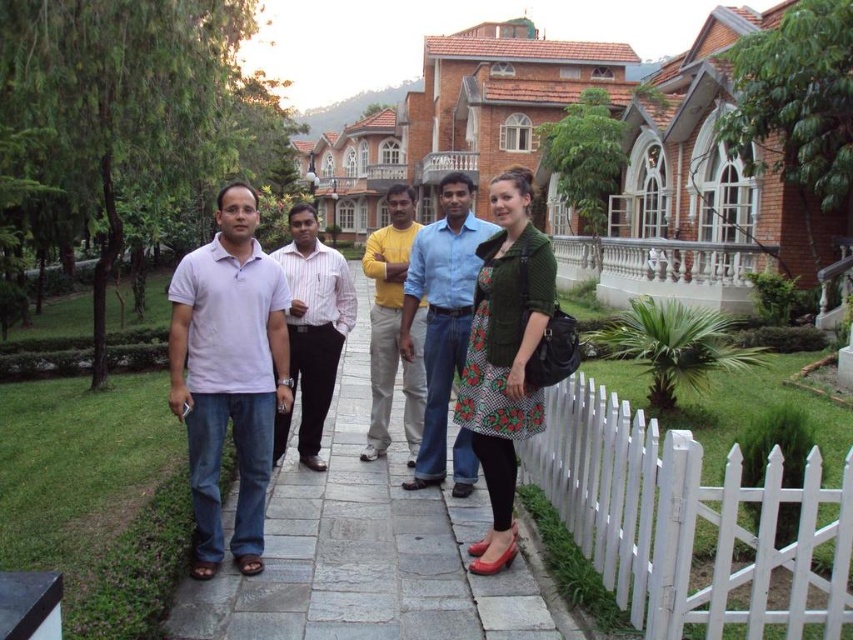
Is white wooden fence at lower right above striped cotton shirt at center?

Incorrect, white wooden fence at lower right is not positioned above striped cotton shirt at center.

Consider the image. Who is shorter, white wooden fence at lower right or striped cotton shirt at center?

Standing shorter between the two is white wooden fence at lower right.

Image resolution: width=853 pixels, height=640 pixels. What do you see at coordinates (689, 522) in the screenshot?
I see `white wooden fence at lower right` at bounding box center [689, 522].

The height and width of the screenshot is (640, 853). I want to click on white wooden fence at lower right, so click(689, 522).

Based on the photo, is white matte shirt at center further to the viewer compared to yellow cotton shirt at center?

That is False.

Who is positioned more to the left, white matte shirt at center or yellow cotton shirt at center?

Positioned to the left is white matte shirt at center.

Is point (190, 337) closer to viewer compared to point (375, 404)?

Yes, point (190, 337) is in front of point (375, 404).

Image resolution: width=853 pixels, height=640 pixels. Find the location of `white matte shirt at center`. white matte shirt at center is located at coordinates (228, 374).

Between white wooden fence at lower right and gray stone pavement at center, which one has less height?

With less height is white wooden fence at lower right.

Does white wooden fence at lower right have a smaller size compared to gray stone pavement at center?

Yes.

Between point (641, 518) and point (358, 540), which one is positioned behind?

The point (358, 540) is more distant.

I want to click on white wooden fence at lower right, so click(689, 522).